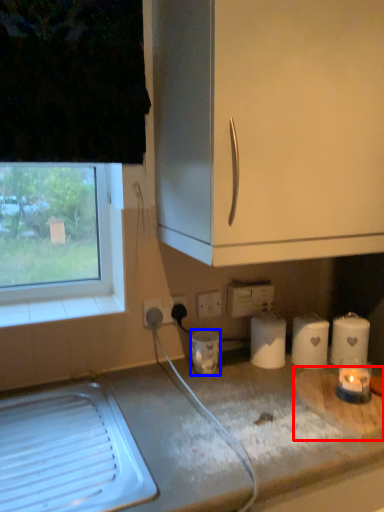
Question: Which object is closer to the camera taking this photo, cutting board (highlighted by a red box) or appliance (highlighted by a blue box)?

Choices:
 (A) cutting board
 (B) appliance

Answer: (A)